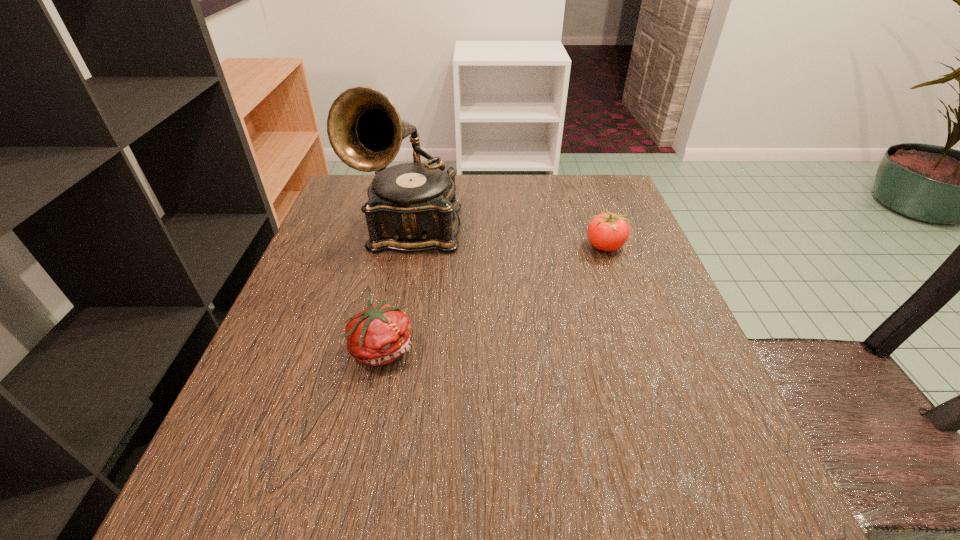
Find the location of a particular element. phonograph record is located at coordinates (412, 207).

Image resolution: width=960 pixels, height=540 pixels. Find the location of `the nearest object`. the nearest object is located at coordinates (378, 335).

Image resolution: width=960 pixels, height=540 pixels. Find the location of `the left tomato`. the left tomato is located at coordinates (378, 335).

The height and width of the screenshot is (540, 960). I want to click on the rightmost object, so click(x=608, y=231).

Identify the location of the farther tomato. (608, 231).

Locate an element on the screen. This screenshot has width=960, height=540. free space located on the horn of the tallest object is located at coordinates (379, 392).

Find the location of a particular element. The height and width of the screenshot is (540, 960). free point located on the right of the nearer tomato is located at coordinates (492, 348).

Locate an element on the screen. This screenshot has height=540, width=960. free location located 0.330m on the left of the right tomato is located at coordinates (430, 246).

Identify the location of object that is at the far edge. Image resolution: width=960 pixels, height=540 pixels. (412, 207).

Locate an element on the screen. The width and height of the screenshot is (960, 540). phonograph record at the left edge is located at coordinates (412, 207).